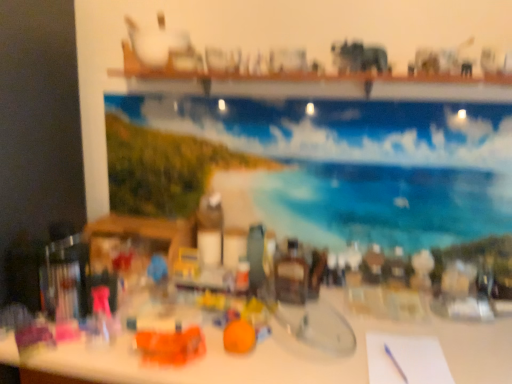
This screenshot has width=512, height=384. I want to click on vacant space underneath orange plastic toy at center, which is the 2th toy from right to left (from a real-world perspective), so click(x=175, y=357).